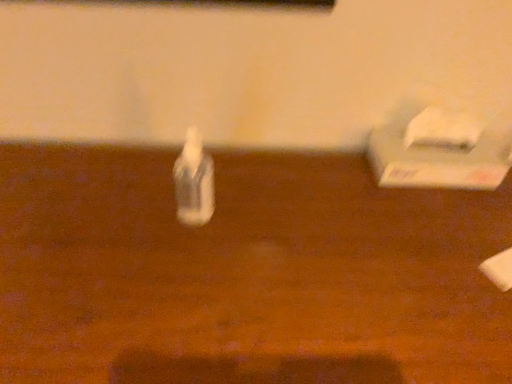
You are a GUI agent. You are given a task and a screenshot of the screen. Output one action in this format:
    pyautogui.click(x=<x>, y=<y>)
    Task: Click on the free space in front of transparent plastic bottle at center
    The height and width of the screenshot is (384, 512).
    Given the screenshot: What is the action you would take?
    pyautogui.click(x=173, y=289)